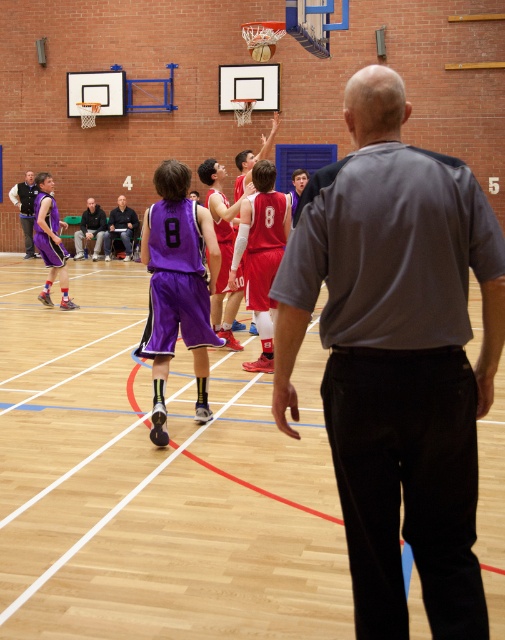
Question: Can you confirm if wooden floor at center is bigger than shiny orange basketball at center?

Choices:
 (A) no
 (B) yes

Answer: (B)

Question: Estimate the real-world distances between objects in this image. Which object is closer to the gray smooth shirt at center?

Choices:
 (A) dark gray pants at center
 (B) dark gray shirt at center

Answer: (B)

Question: Where is dark gray shirt at center located in relation to matte black jacket at left in the image?

Choices:
 (A) left
 (B) right

Answer: (B)

Question: Which object appears closest to the camera in this image?

Choices:
 (A) gray smooth shirt at center
 (B) wooden floor at center
 (C) dark gray shirt at center
 (D) dark gray pants at center

Answer: (A)

Question: Among these objects, which one is nearest to the camera?

Choices:
 (A) dark gray shirt at center
 (B) wooden floor at center
 (C) shiny orange basketball at center
 (D) dark gray pants at center

Answer: (B)

Question: Does wooden floor at center have a larger size compared to dark gray pants at center?

Choices:
 (A) yes
 (B) no

Answer: (A)